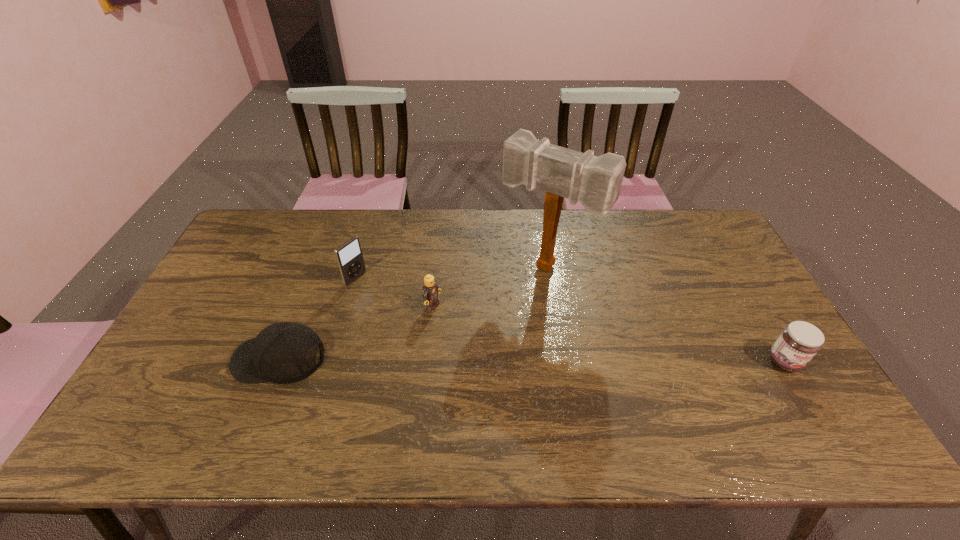
In order to click on vacant space on the desktop that is between the cap and the jam and is positioned at the head of the tallest object in this screenshot , I will do `click(478, 360)`.

At what (x,y) coordinates should I click in order to perform the action: click on free spot on the desktop that is between the cap and the rightmost object and is positioned on the front-facing side of the iPod. Please return your answer as a coordinate pair (x, y). This screenshot has height=540, width=960. Looking at the image, I should click on (500, 360).

Where is `vacant space on the desktop that is between the cap and the rightmost object and is positioned in front of the third nearest object`? vacant space on the desktop that is between the cap and the rightmost object and is positioned in front of the third nearest object is located at coordinates [x=534, y=360].